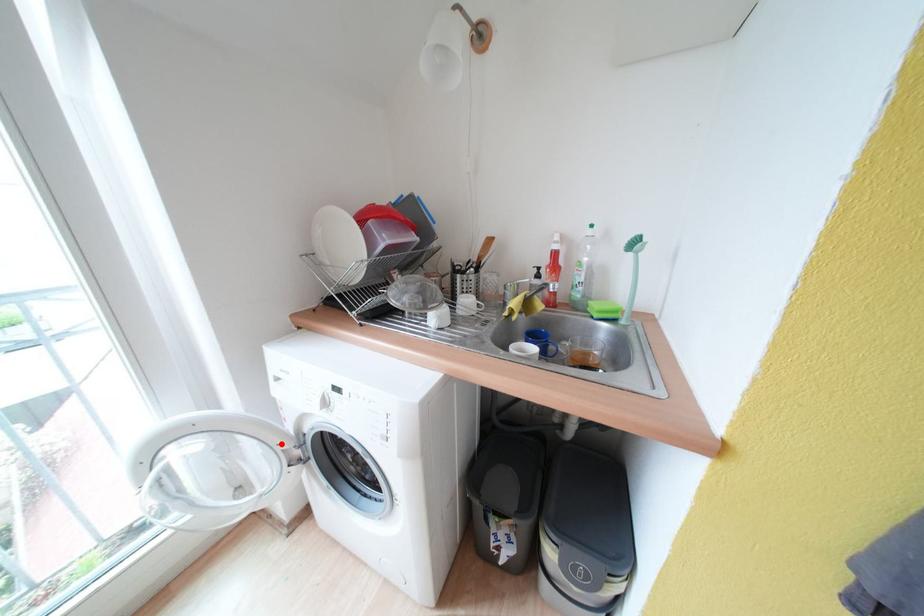
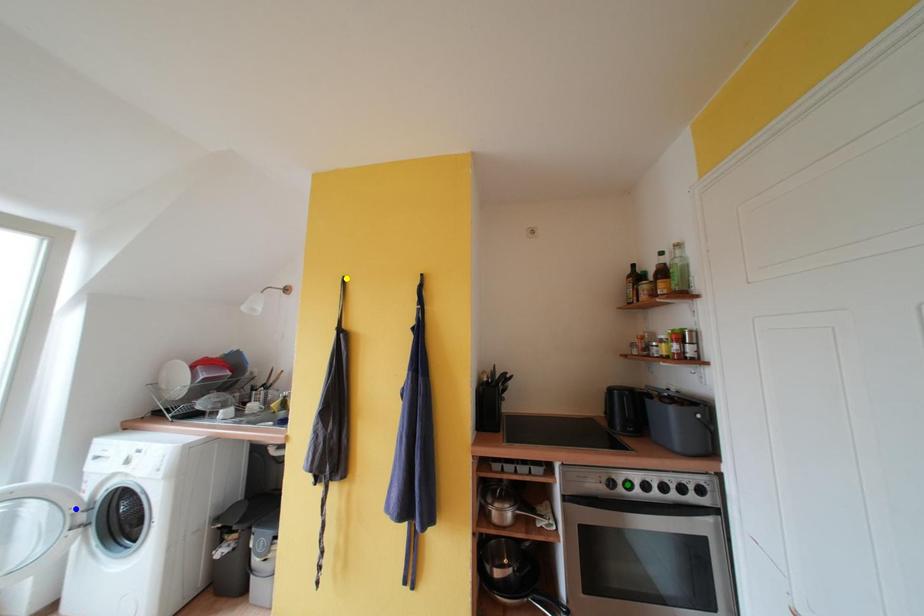
Question: I am providing you with two images of the same scene from different viewpoints. A red point is marked on the first image. You are given multiple points on the second image. Which point in image 2 is actually the same real-world point as the red point in image 1?

Choices:
 (A) yellow point
 (B) green point
 (C) blue point

Answer: (C)